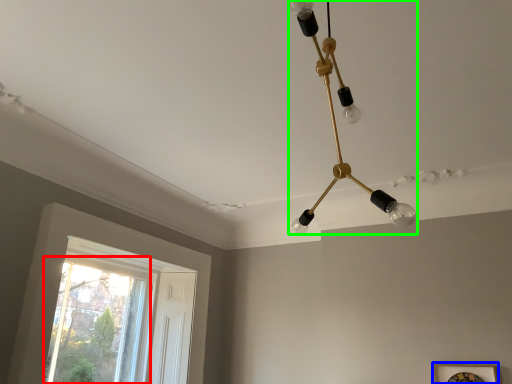
Question: Estimate the real-world distances between objects in this image. Which object is closer to window (highlighted by a red box), picture frame (highlighted by a blue box) or lamp (highlighted by a green box)?

Choices:
 (A) picture frame
 (B) lamp

Answer: (A)